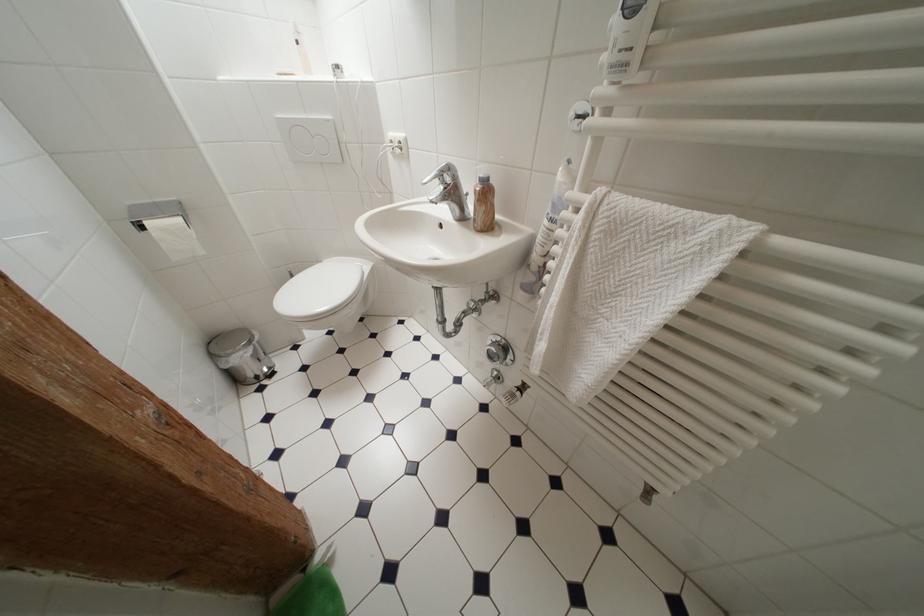
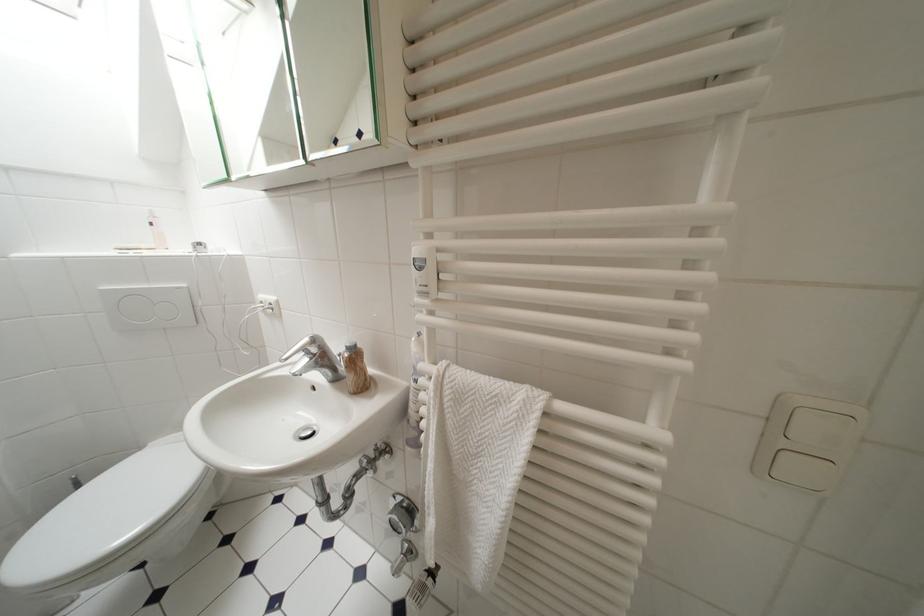
Where in the second image is the point corresponding to point (333, 124) from the first image?

(185, 291)